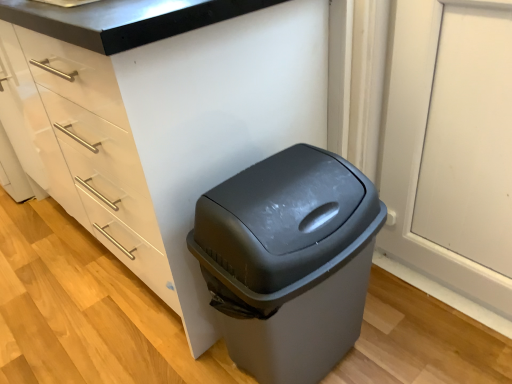
Question: Does white glossy cabinet at center lie behind gray plastic trash can at center?

Choices:
 (A) yes
 (B) no

Answer: (B)

Question: Would you say white glossy cabinet at center is outside gray plastic trash can at center?

Choices:
 (A) no
 (B) yes

Answer: (B)

Question: Are white glossy cabinet at center and gray plastic trash can at center beside each other?

Choices:
 (A) yes
 (B) no

Answer: (B)

Question: Can gray plastic trash can at center be found inside white glossy cabinet at center?

Choices:
 (A) no
 (B) yes

Answer: (A)

Question: Can you confirm if white glossy cabinet at center is thinner than gray plastic trash can at center?

Choices:
 (A) no
 (B) yes

Answer: (A)

Question: Considering the relative sizes of white glossy cabinet at center and gray plastic trash can at center in the image provided, is white glossy cabinet at center shorter than gray plastic trash can at center?

Choices:
 (A) no
 (B) yes

Answer: (A)

Question: Can you confirm if gray plastic trash can at center is shorter than white glossy cabinet at center?

Choices:
 (A) no
 (B) yes

Answer: (B)

Question: Does gray plastic trash can at center touch white glossy cabinet at center?

Choices:
 (A) yes
 (B) no

Answer: (B)

Question: From the image's perspective, is gray plastic trash can at center located above white glossy cabinet at center?

Choices:
 (A) yes
 (B) no

Answer: (B)

Question: Could you tell me if gray plastic trash can at center is turned towards white glossy cabinet at center?

Choices:
 (A) yes
 (B) no

Answer: (B)

Question: Is gray plastic trash can at center oriented away from white glossy cabinet at center?

Choices:
 (A) yes
 (B) no

Answer: (A)

Question: Considering the relative sizes of gray plastic trash can at center and white glossy cabinet at center in the image provided, is gray plastic trash can at center taller than white glossy cabinet at center?

Choices:
 (A) yes
 (B) no

Answer: (B)

Question: From the image's perspective, is white glossy cabinet at center positioned above or below gray plastic trash can at center?

Choices:
 (A) above
 (B) below

Answer: (A)